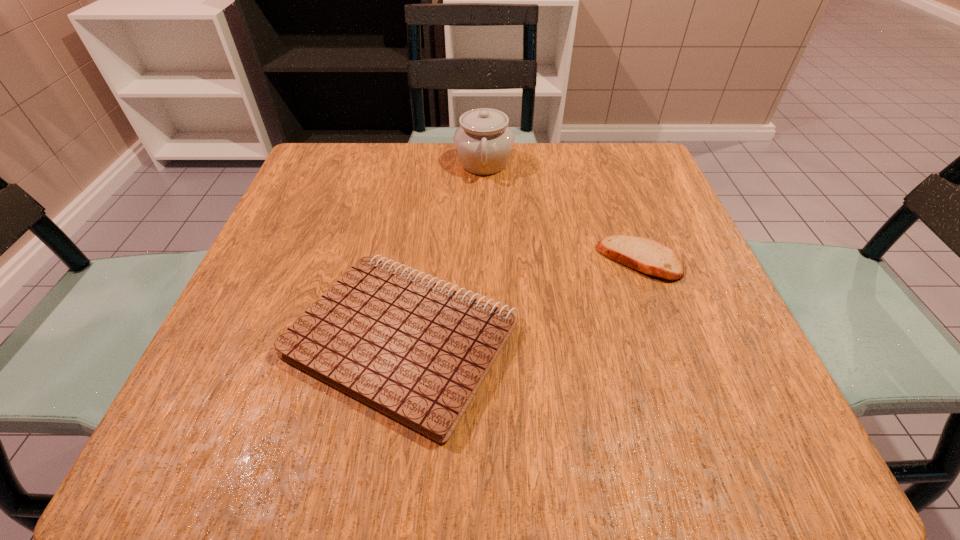
Find the location of `the farthest object`. the farthest object is located at coordinates (483, 143).

You are a GUI agent. You are given a task and a screenshot of the screen. Output one action in this format:
    pyautogui.click(x=<x>, y=<y>)
    Task: Click on the chinaware
    The height and width of the screenshot is (540, 960).
    Given the screenshot: What is the action you would take?
    pyautogui.click(x=483, y=143)

Where is `notebook`? This screenshot has height=540, width=960. notebook is located at coordinates point(417,351).

This screenshot has width=960, height=540. Find the location of `pita bread`. pita bread is located at coordinates (645, 255).

Identify the location of the rightmost object. The height and width of the screenshot is (540, 960). (645, 255).

You are a GUI agent. You are given a task and a screenshot of the screen. Output one action in this format:
    pyautogui.click(x=<x>, y=<y>)
    Task: Click on the vacant region located 0.080m on the front of the farthest object
    The image size is (960, 540).
    Given the screenshot: What is the action you would take?
    pyautogui.click(x=485, y=207)

Locate an element on the screen. The height and width of the screenshot is (540, 960). vacant area situated on the back of the notebook is located at coordinates (422, 202).

At what (x,y) coordinates should I click in order to perform the action: click on free space located on the front of the pita bread. Please return your answer as a coordinate pair (x, y). The height and width of the screenshot is (540, 960). Looking at the image, I should click on (703, 438).

I want to click on object present at the far edge, so [x=483, y=143].

What are the coordinates of `object that is at the near edge` in the screenshot? It's located at (417, 351).